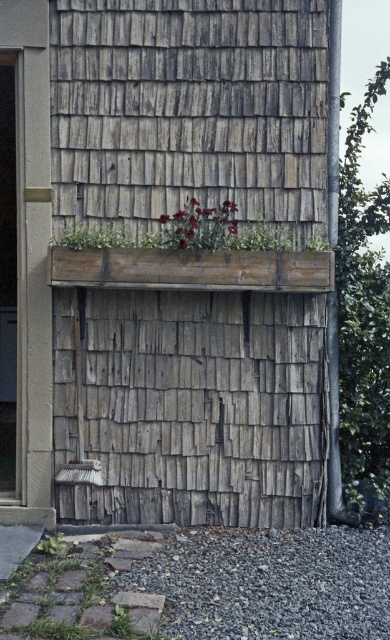
Question: From the image, what is the correct spatial relationship of deep red petals at center in relation to green matte planter at center?

Choices:
 (A) left
 (B) right

Answer: (B)

Question: Considering the real-world distances, which object is farthest from the weathered wood hut at center?

Choices:
 (A) green matte planter at center
 (B) deep red petals at center
 (C) green leafy plant at right

Answer: (C)

Question: In this image, where is weathered wood hut at center located relative to green leafy plant at right?

Choices:
 (A) left
 (B) right

Answer: (A)

Question: Which point is farther to the camera?

Choices:
 (A) green leafy plant at right
 (B) green matte planter at center

Answer: (A)

Question: Estimate the real-world distances between objects in this image. Which object is closer to the deep red petals at center?

Choices:
 (A) green matte planter at center
 (B) green leafy plant at right
 (C) weathered wood hut at center

Answer: (C)

Question: Can you confirm if weathered wood hut at center is positioned below green leafy plant at right?

Choices:
 (A) yes
 (B) no

Answer: (B)